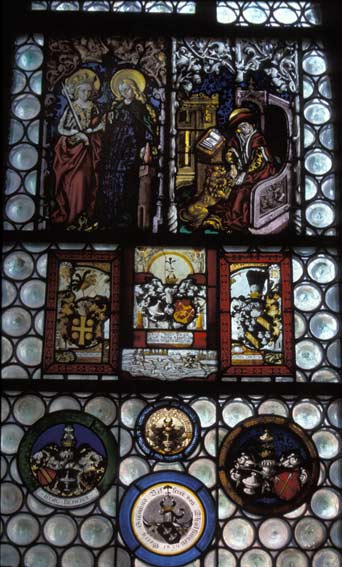
Identify the location of painting. This screenshot has width=342, height=567. (228, 177).